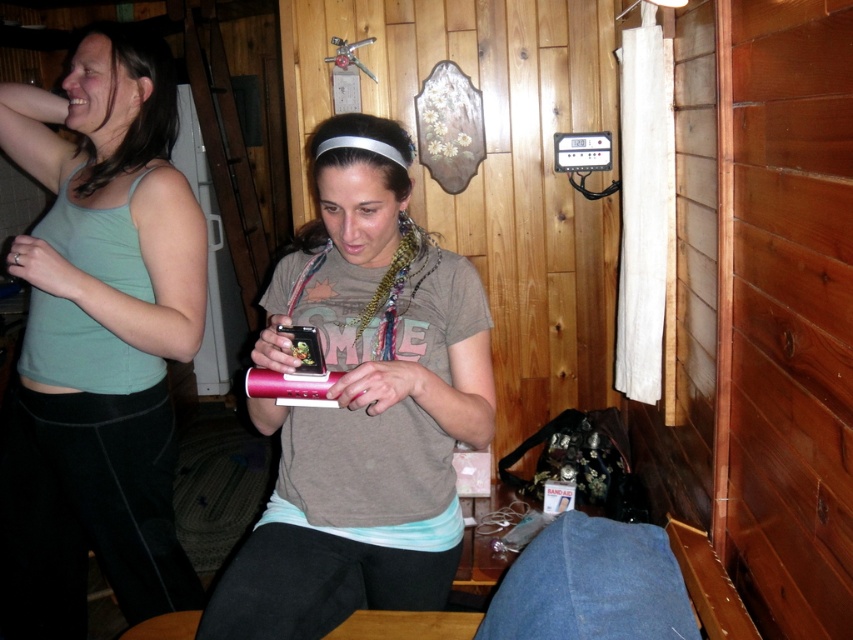
Question: In this image, where is matte green tank top at left located relative to pink plastic phone at center?

Choices:
 (A) above
 (B) below

Answer: (A)

Question: Is matte green tank top at left to the right of pink plastic phone at center from the viewer's perspective?

Choices:
 (A) yes
 (B) no

Answer: (B)

Question: Which point is farther to the camera?

Choices:
 (A) (112, 109)
 (B) (271, 568)

Answer: (A)

Question: Does matte green tank top at left appear on the right side of pink plastic phone at center?

Choices:
 (A) yes
 (B) no

Answer: (B)